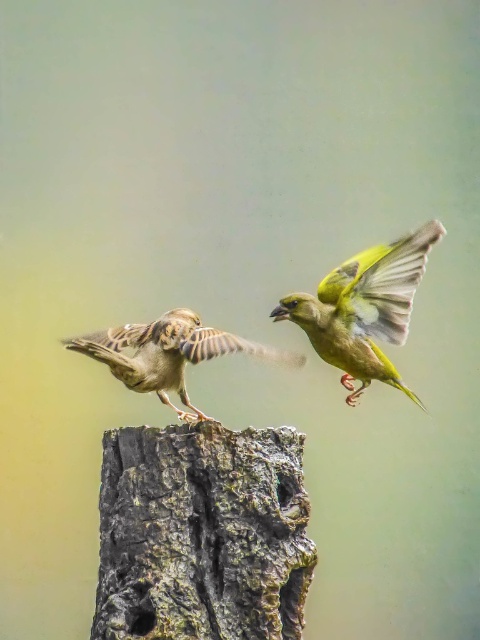
You are a birdwatcher observing the two birds on the tree stump. Which bird is taller between the green glossy bird at center and the brown speckled sparrow at center?

The green glossy bird at center is taller than the brown speckled sparrow at center.

You are a birdwatcher observing the rough bark tree trunk at center and the brown speckled sparrow at center. Which object is taller?

The rough bark tree trunk at center is taller than the brown speckled sparrow at center.

You are a birdwatcher observing the scene. You notice the rough bark tree trunk at center and the green glossy bird at center. Which object is closer to you?

The rough bark tree trunk at center is closer to you because it is positioned in front of the green glossy bird at center.